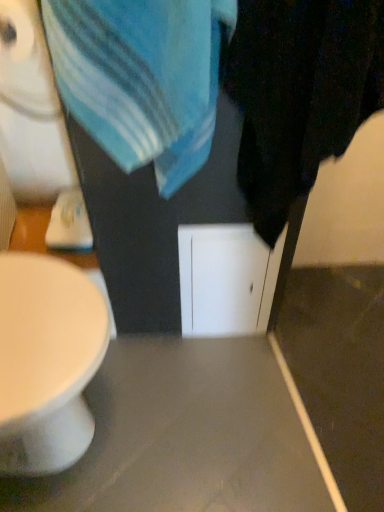
Question: Considering their positions, is black matte towel at right located in front of or behind blue cotton towel at upper center?

Choices:
 (A) behind
 (B) front

Answer: (B)

Question: Is black matte towel at right taller or shorter than blue cotton towel at upper center?

Choices:
 (A) tall
 (B) short

Answer: (A)

Question: Estimate the real-world distances between objects in this image. Which object is closer to the black matte towel at right?

Choices:
 (A) white paper at upper left
 (B) matte gray table at center
 (C) blue cotton towel at upper center

Answer: (C)

Question: Which of these objects is positioned closest to the black matte towel at right?

Choices:
 (A) blue cotton towel at upper center
 (B) matte gray table at center
 (C) white paper at upper left

Answer: (A)